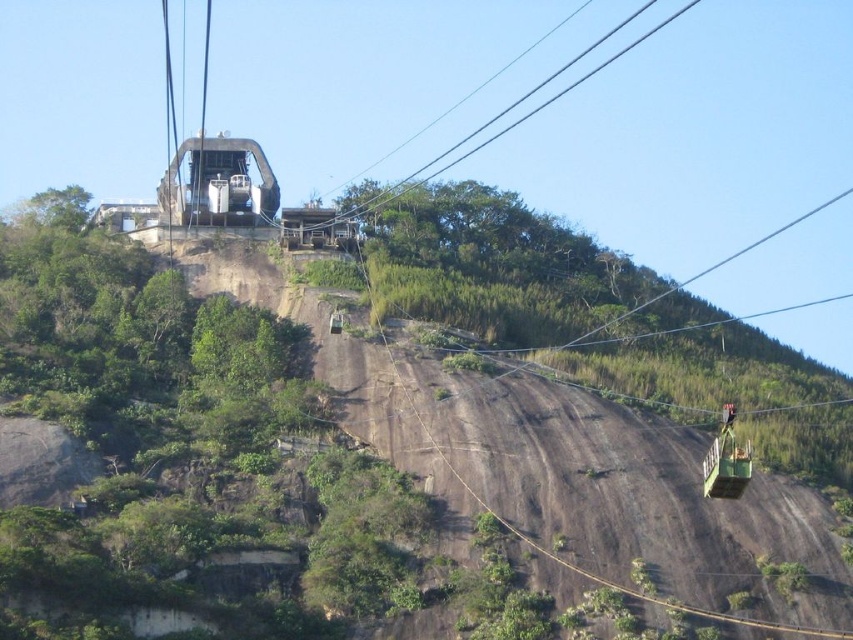
You are a tourist standing at the base of the mountain looking up at the cable cars. Which cable car, the green metallic cable car at right or the metallic gray cable car at upper center, is closer to you?

The green metallic cable car at right is closer to you because it is in front of the metallic gray cable car at upper center.

You are a hiker standing at the cable car station in the midground. You see a point marked at coordinates (x=726, y=460). What object is located at this point?

The point at coordinates (x=726, y=460) corresponds to the green metallic cable car at right.

Based on the photo, you are a visitor at the cable car station and want to board the first available cable car. Which one should you go to, the green metallic cable car at right or the metallic gray cable car at upper center?

You should go to the metallic gray cable car at upper center because the green metallic cable car at right is to the right of it, meaning the metallic gray cable car at upper center is closer to the station and would be the first available.